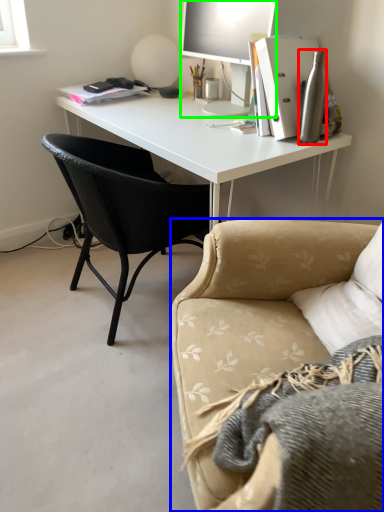
Question: Which object is positioned closest to bottle (highlighted by a red box)? Select from studio couch (highlighted by a blue box) and television (highlighted by a green box).

Choices:
 (A) studio couch
 (B) television

Answer: (B)